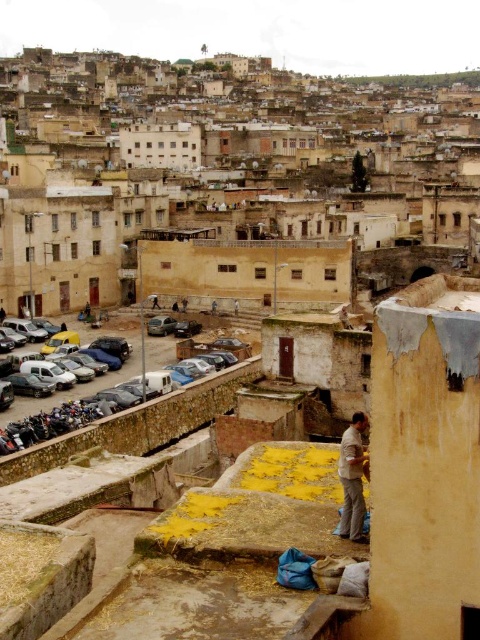
You are a delivery person needing to move a package from the matte black car at left to the light brown fabric at lower right. Given that your cart can carry items up to 30 meters, can you transport the package without needing to stop?

The distance between the matte black car at left and the light brown fabric at lower right is 37.56 meters, which exceeds the cart capacity of 30 meters. Therefore, you will need to stop midway to continue the delivery.

From the picture: You are a delivery person who needs to park your vehicle in the parking area near the matte black car at left and the light brown fabric at lower right. Considering their heights, which object would block your view if you park directly behind it?

The matte black car at left is taller than the light brown fabric at lower right, so parking behind the matte black car at left would block your view more than parking behind the light brown fabric at lower right.

You are a delivery person trying to reach the light brown fabric at lower right. There is a matte black car at left blocking your path. Can you walk around the car to get to the fabric?

The matte black car at left is above light brown fabric at lower right, so you can walk around the car to reach the fabric since it is elevated and not directly blocking the path.